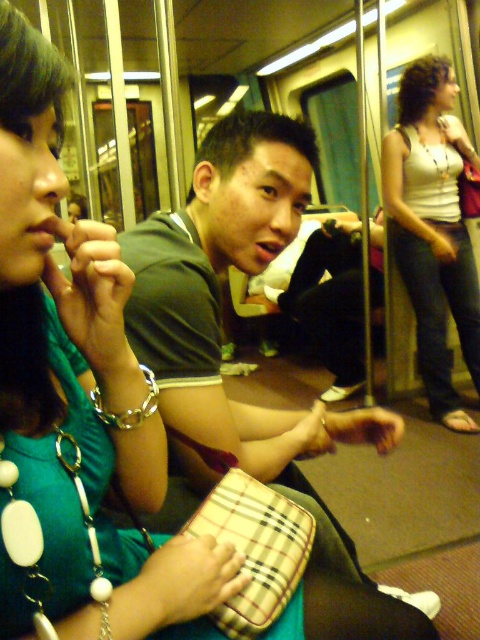
You are a photographer standing in the subway car and want to take a photo of the green matte shirt at center and the white tank top at right. If your camera can focus on objects within a 5 feet range, will both subjects be in focus?

The green matte shirt at center is 5.78 feet away from the white tank top at right. Since the camera can only focus within 5 feet, the distance between them exceeds the focus range, so both subjects might not be in focus simultaneously.

You are a photographer trying to capture a candid shot of the two people in the subway car. You want to ensure both the green matte shirt at center and the white tank top at right are clearly visible in the frame. Given their sizes, which one might require more space in the composition?

The green matte shirt at center requires more space in the composition because its width is larger than the white tank top at right.

You are standing at the entrance of the subway car and want to find the green matte shirt at center. According to the coordinates provided, in which direction should you look relative to your position?

The green matte shirt at center is located at coordinates point (218, 301), which is slightly to the right and forward from your position at the entrance. You should look towards the central area of the subway car, slightly to the right.